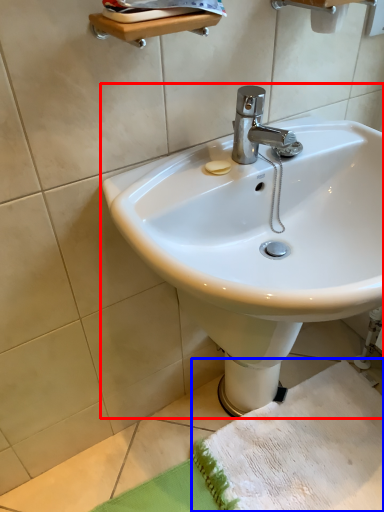
Question: Which object is closer to the camera taking this photo, sink (highlighted by a red box) or beach towel (highlighted by a blue box)?

Choices:
 (A) sink
 (B) beach towel

Answer: (A)